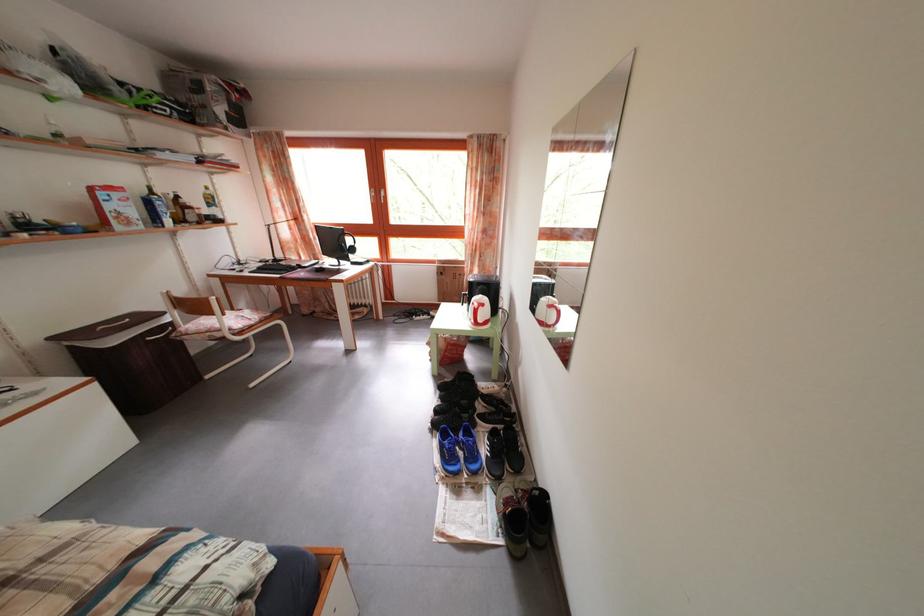
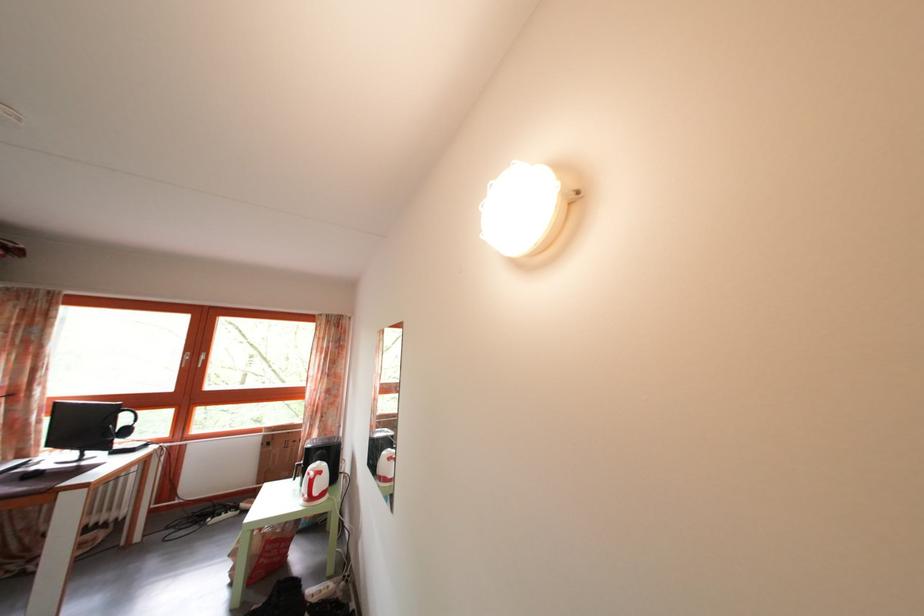
Where in the second image is the point corresponding to point (454, 359) from the first image?

(268, 562)